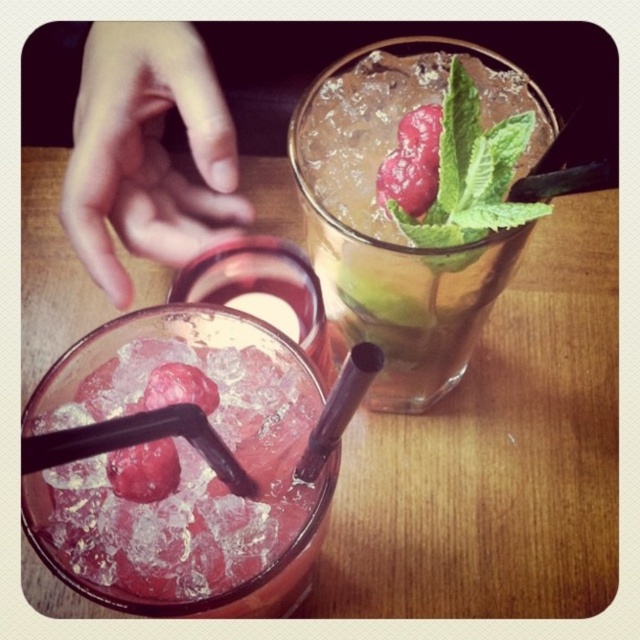
Can you confirm if pink bracelet at upper left is bigger than green leafy mint at upper right?

Correct, pink bracelet at upper left is larger in size than green leafy mint at upper right.

Who is taller, pink bracelet at upper left or green leafy mint at upper right?

pink bracelet at upper left

In order to click on pink bracelet at upper left in this screenshot , I will do `click(147, 152)`.

Can you confirm if translucent glass at center is positioned to the right of pink bracelet at upper left?

Yes, translucent glass at center is to the right of pink bracelet at upper left.

Locate an element on the screen. The height and width of the screenshot is (640, 640). translucent glass at center is located at coordinates (182, 472).

Who is shorter, wooden table at center or translucent glass at center?

translucent glass at center is shorter.

Does wooden table at center have a greater width compared to translucent glass at center?

Yes, wooden table at center is wider than translucent glass at center.

Is point (275, 212) behind point (228, 344)?

Yes, it is.

Locate an element on the screen. The width and height of the screenshot is (640, 640). wooden table at center is located at coordinates (497, 456).